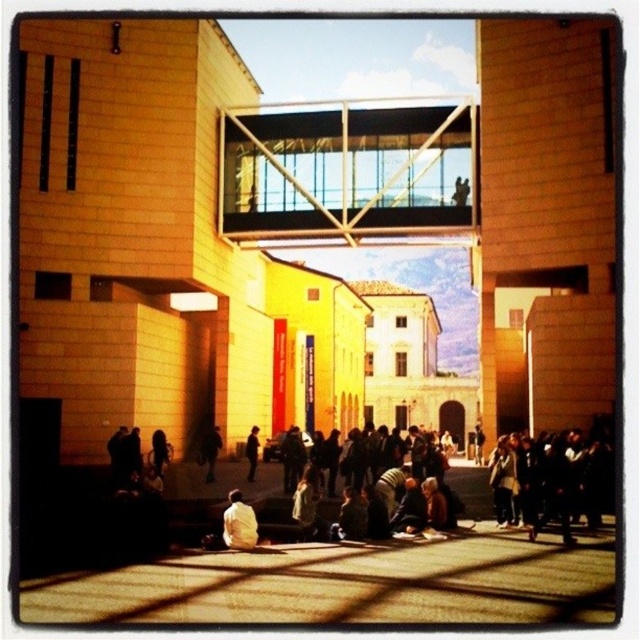
Is dark gray fabric crowd at lower right to the left of dark gray jacket at center from the viewer's perspective?

In fact, dark gray fabric crowd at lower right is to the right of dark gray jacket at center.

Is dark gray fabric crowd at lower right taller than dark gray jacket at center?

Correct, dark gray fabric crowd at lower right is much taller as dark gray jacket at center.

Locate an element on the screen. This screenshot has height=640, width=640. dark gray fabric crowd at lower right is located at coordinates (556, 477).

Does light beige fabric at lower center come in front of dark gray jacket at center?

Yes, it is in front of dark gray jacket at center.

How much distance is there between light beige fabric at lower center and dark gray jacket at center?

light beige fabric at lower center and dark gray jacket at center are 14.99 meters apart from each other.

Where is `light beige fabric at lower center`? The width and height of the screenshot is (640, 640). light beige fabric at lower center is located at coordinates (237, 524).

Between white fabric bag at center and dark gray jacket at center, which one is positioned higher?

white fabric bag at center is higher up.

Who is more distant from viewer, (218, 448) or (252, 458)?

The point (218, 448) is behind.

The width and height of the screenshot is (640, 640). Describe the element at coordinates (211, 451) in the screenshot. I see `white fabric bag at center` at that location.

Find the location of a particular element. white fabric bag at center is located at coordinates (211, 451).